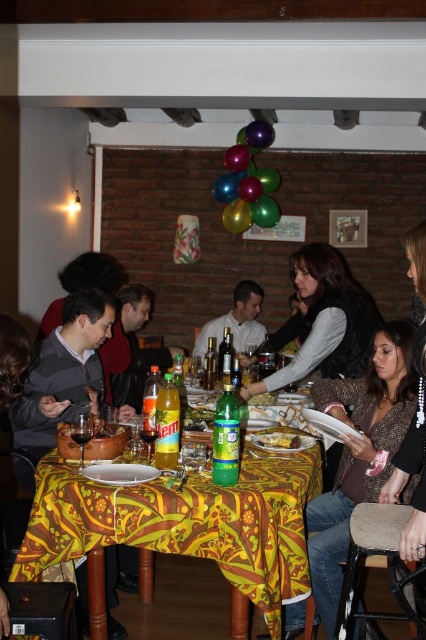
Question: Which of the following is the closest to the observer?

Choices:
 (A) yellow printed fabric at center
 (B) metallic green balloon at upper center
 (C) green glass bottle at center
 (D) matte gray sweater at left

Answer: (A)

Question: Which point is farther to the camera?

Choices:
 (A) yellow matte plate at center
 (B) orange matte soda at table center
 (C) metallic green balloon at upper center
 (D) metallic balloons at center

Answer: (C)

Question: Can you confirm if matte black jacket at center is bigger than metallic green balloon at upper center?

Choices:
 (A) no
 (B) yes

Answer: (B)

Question: Which of the following is the farthest from the observer?

Choices:
 (A) matte white shirt at center
 (B) orange matte soda at table center
 (C) yellow matte plate at center
 (D) yellow printed fabric at center

Answer: (A)

Question: Does matte gray sweater at left appear on the left side of matte black jacket at center?

Choices:
 (A) yes
 (B) no

Answer: (A)

Question: Considering the relative positions of brown textured blazer at lower right and matte white shirt at center in the image provided, where is brown textured blazer at lower right located with respect to matte white shirt at center?

Choices:
 (A) above
 (B) below

Answer: (B)